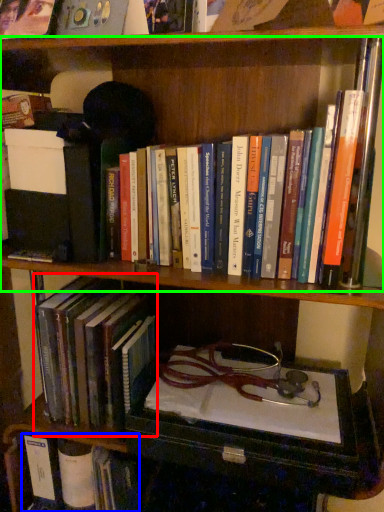
Question: Which is farther away from book (highlighted by a red box)? book (highlighted by a blue box) or book (highlighted by a green box)?

Choices:
 (A) book
 (B) book

Answer: (B)